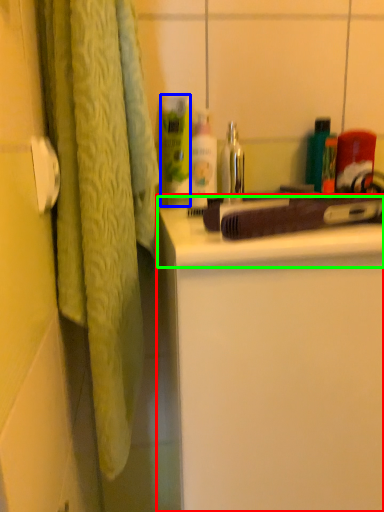
Question: Estimate the real-world distances between objects in this image. Which object is closer to bathroom cabinet (highlighted by a red box), cleaning product (highlighted by a blue box) or counter top (highlighted by a green box)?

Choices:
 (A) cleaning product
 (B) counter top

Answer: (B)